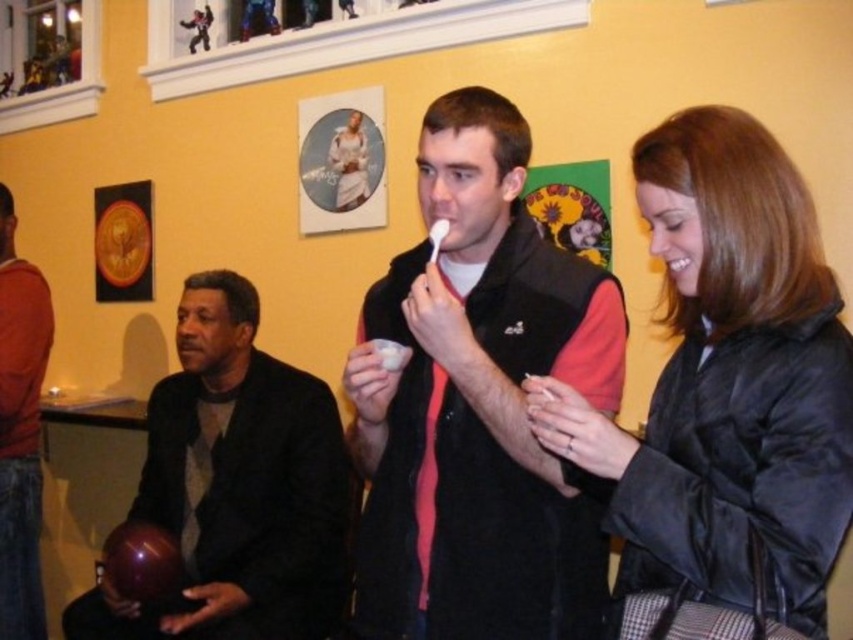
Question: Is black puffy jacket at center to the left of orange cotton shirt at left from the viewer's perspective?

Choices:
 (A) no
 (B) yes

Answer: (A)

Question: Which of the following is the farthest from the observer?

Choices:
 (A) black puffy jacket at center
 (B) shiny black bowling ball at left
 (C) orange cotton shirt at left

Answer: (C)

Question: Which of the following is the farthest from the observer?

Choices:
 (A) shiny black bowling ball at left
 (B) black puffy jacket at center

Answer: (A)

Question: Which point is farther to the camera?

Choices:
 (A) black puffy jacket at center
 (B) shiny black bowling ball at left

Answer: (B)

Question: Can you confirm if black puffy jacket at center is positioned to the right of orange cotton shirt at left?

Choices:
 (A) no
 (B) yes

Answer: (B)

Question: Can you confirm if black puffy jacket at center is positioned above orange cotton shirt at left?

Choices:
 (A) yes
 (B) no

Answer: (A)